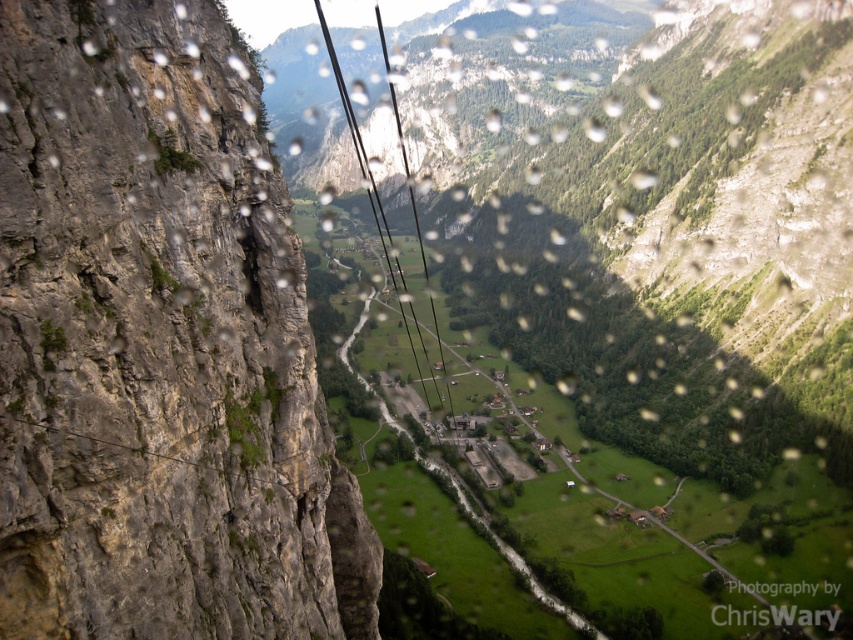
Question: Which of the following is the closest to the observer?

Choices:
 (A) (387, 264)
 (B) (216, 552)

Answer: (B)

Question: From the image, what is the correct spatial relationship of rocky gray at left in relation to black wire at center?

Choices:
 (A) left
 (B) right

Answer: (B)

Question: Is rocky gray at left bigger than black wire at center?

Choices:
 (A) yes
 (B) no

Answer: (B)

Question: Which point appears closest to the camera in this image?

Choices:
 (A) (28, 260)
 (B) (387, 250)

Answer: (A)

Question: From the image, what is the correct spatial relationship of rocky gray at left in relation to black wire at center?

Choices:
 (A) above
 (B) below

Answer: (B)